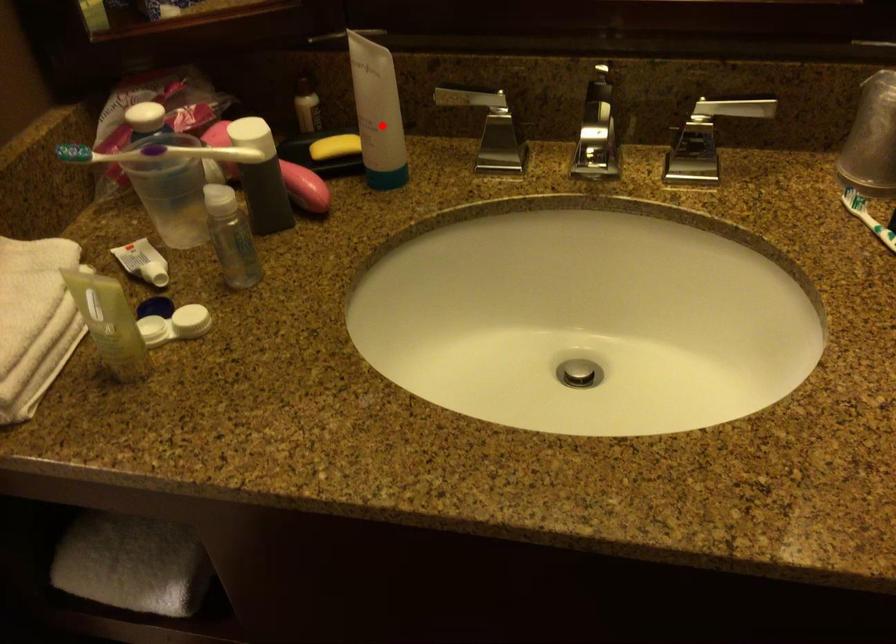
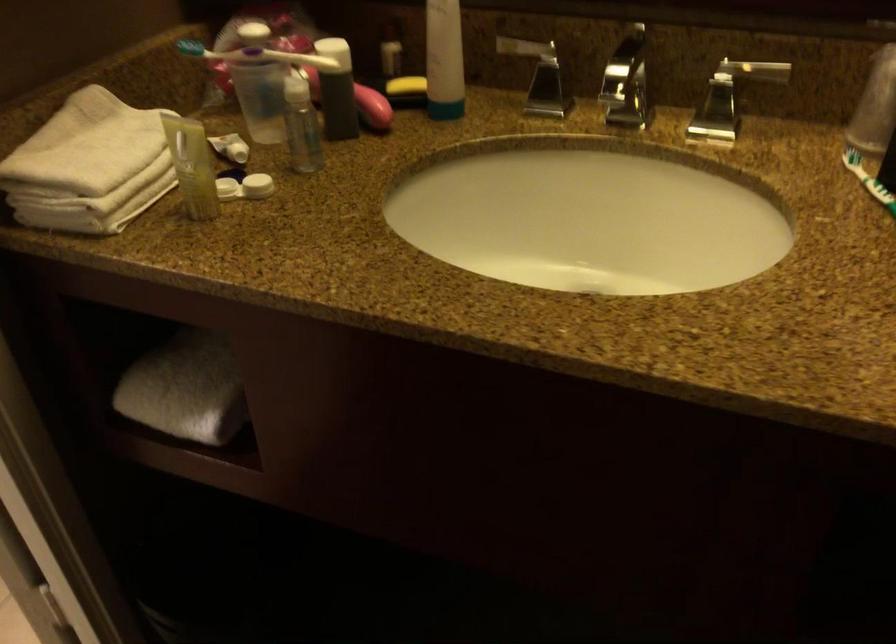
Locate, in the second image, the point that corresponds to the highlighted location in the first image.

(444, 60)